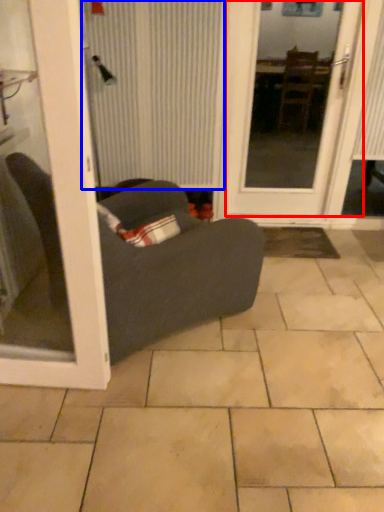
Question: Which point is closer to the camera, door (highlighted by a red box) or curtain (highlighted by a blue box)?

Choices:
 (A) door
 (B) curtain

Answer: (A)